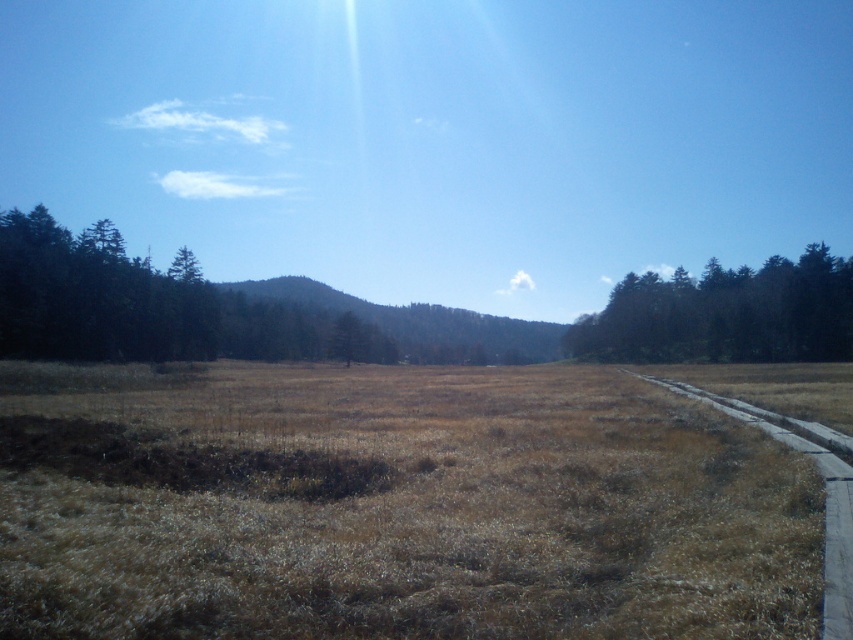
Is point (125, 298) behind point (737, 273)?

No, (125, 298) is in front of (737, 273).

Is point (83, 291) farther from viewer compared to point (791, 317)?

No, it is not.

Locate an element on the screen. Image resolution: width=853 pixels, height=640 pixels. dark green textured trees at left is located at coordinates (94, 298).

Does dark green textured trees at left appear under gray concrete path at right?

No.

Does dark green textured trees at left appear on the right side of gray concrete path at right?

Incorrect, dark green textured trees at left is not on the right side of gray concrete path at right.

Which is in front, point (80, 252) or point (831, 486)?

Point (831, 486) is in front.

Where is `dark green textured trees at left`? dark green textured trees at left is located at coordinates (x=94, y=298).

Can you confirm if brown dry grass at center is positioned below dark green textured trees at left?

Indeed, brown dry grass at center is positioned under dark green textured trees at left.

Between brown dry grass at center and dark green textured trees at left, which one appears on the left side from the viewer's perspective?

dark green textured trees at left is more to the left.

Who is more forward, [755,451] or [91,273]?

Point [755,451] is in front.

Locate an element on the screen. brown dry grass at center is located at coordinates point(393,506).